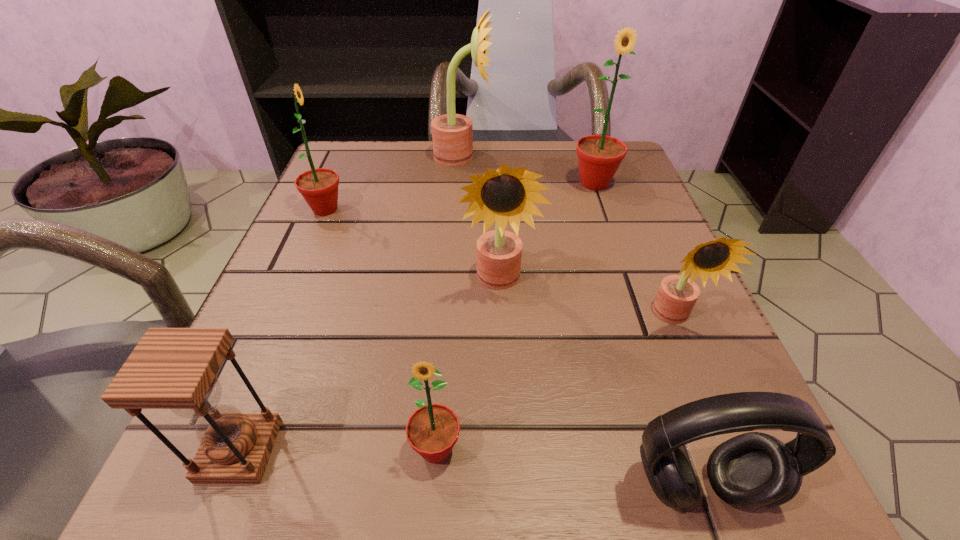
Where is `the farthest yellow sunflower`? Image resolution: width=960 pixels, height=540 pixels. the farthest yellow sunflower is located at coordinates (452, 134).

The image size is (960, 540). Identify the location of the biggest green sunflower. (599, 156).

You are a GUI agent. You are given a task and a screenshot of the screen. Output one action in this format:
    pyautogui.click(x=<x>, y=<y>)
    Task: Click on the rightmost green sunflower
    The height and width of the screenshot is (540, 960).
    Given the screenshot: What is the action you would take?
    pyautogui.click(x=599, y=156)

This screenshot has height=540, width=960. I want to click on the leftmost green sunflower, so click(319, 187).

Identify the location of the second biggest green sunflower. (319, 187).

You are a GUI agent. You are given a task and a screenshot of the screen. Output one action in this format:
    pyautogui.click(x=<x>, y=<y>)
    Task: Click on the second smallest yellow sunflower
    
    Given the screenshot: What is the action you would take?
    (506, 195)

I want to click on the smallest yellow sunflower, so click(677, 295).

At what (x,y) coordinates should I click in order to perform the action: click on the nearest sunflower. Please return your answer as a coordinate pair (x, y). The height and width of the screenshot is (540, 960). Looking at the image, I should click on (432, 430).

Identify the location of the second green sunflower from right to left. The width and height of the screenshot is (960, 540). (432, 430).

At what (x,y) coordinates should I click in order to perform the action: click on hourglass. Please return your answer as a coordinate pair (x, y). Looking at the image, I should click on (170, 368).